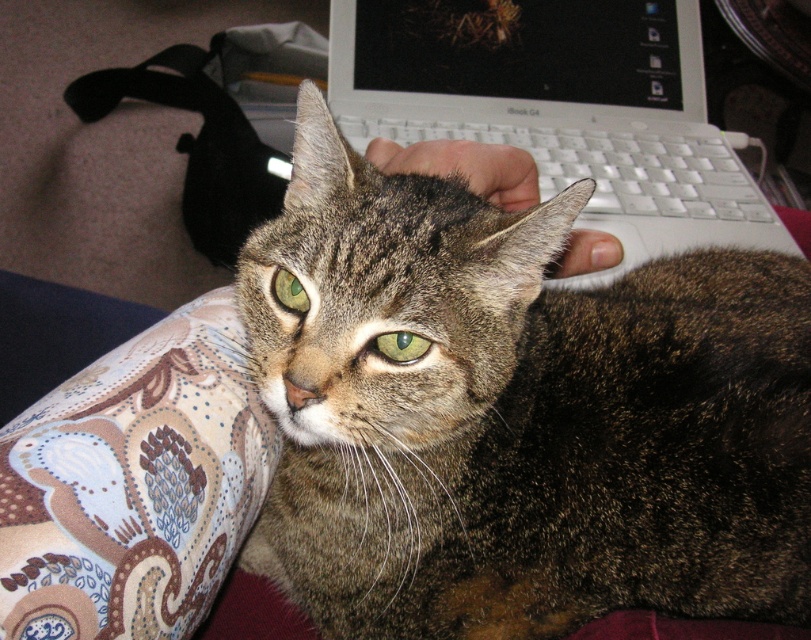
Between point (689, 182) and point (402, 333), which one is positioned behind?

Positioned behind is point (689, 182).

You are a GUI agent. You are given a task and a screenshot of the screen. Output one action in this format:
    pyautogui.click(x=<x>, y=<y>)
    Task: Click on the white plastic laptop at upper center
    
    Given the screenshot: What is the action you would take?
    pyautogui.click(x=560, y=108)

Does point (569, 10) lie in front of point (402, 337)?

No, it is not.

I want to click on white plastic laptop at upper center, so click(560, 108).

Is white plastic keyboard at upper center to the right of green glossy eye at center from the viewer's perspective?

Indeed, white plastic keyboard at upper center is positioned on the right side of green glossy eye at center.

Who is positioned more to the left, white plastic keyboard at upper center or green glossy eye at center?

From the viewer's perspective, green glossy eye at center appears more on the left side.

At what (x,y) coordinates should I click in order to perform the action: click on white plastic keyboard at upper center. Please return your answer as a coordinate pair (x, y). Looking at the image, I should click on (606, 164).

Measure the distance between tabby fur cat at center and white plastic keyboard at upper center.

tabby fur cat at center is 19.14 inches away from white plastic keyboard at upper center.

Who is higher up, tabby fur cat at center or white plastic keyboard at upper center?

white plastic keyboard at upper center is above.

The height and width of the screenshot is (640, 811). I want to click on tabby fur cat at center, so click(x=518, y=413).